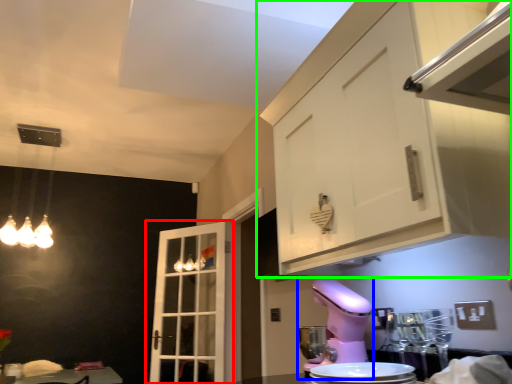
Question: Which object is positioned farthest from door (highlighted by a red box)? Select from mixer (highlighted by a blue box) and cabinetry (highlighted by a green box).

Choices:
 (A) mixer
 (B) cabinetry

Answer: (B)